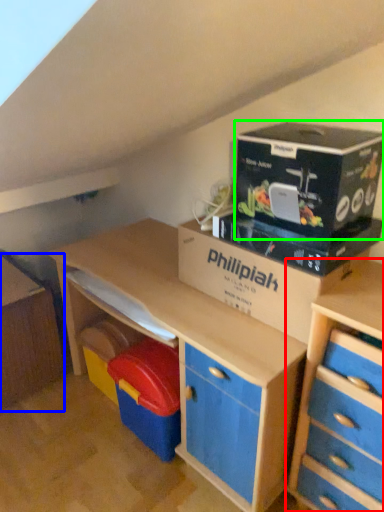
Question: Which object is the closest to the chest of drawers (highlighted by a red box)? Choose among these: file cabinet (highlighted by a blue box) or cardboard (highlighted by a green box).

Choices:
 (A) file cabinet
 (B) cardboard

Answer: (B)